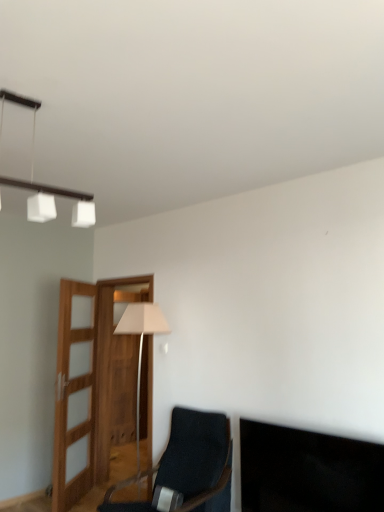
Describe the element at coordinates (46, 185) in the screenshot. I see `white matte cube at upper left` at that location.

This screenshot has width=384, height=512. What do you see at coordinates (141, 347) in the screenshot?
I see `white fabric lampshade at center` at bounding box center [141, 347].

Identify the location of black glossy tv at lower right. The image size is (384, 512). (308, 471).

From a real-world perspective, is black glossy tv at lower right physically below dark blue fabric chair at center?

No, from a real-world perspective, black glossy tv at lower right is not under dark blue fabric chair at center.

Is there a large distance between black glossy tv at lower right and dark blue fabric chair at center?

They are positioned close to each other.

From the image's perspective, which one is positioned higher, black glossy tv at lower right or dark blue fabric chair at center?

black glossy tv at lower right is shown above in the image.

Is point (146, 325) less distant than point (381, 463)?

No, (146, 325) is behind (381, 463).

The height and width of the screenshot is (512, 384). What are the coordinates of `table lamp behind the black glossy tv at lower right` in the screenshot? It's located at (141, 347).

Would you say white fabric lampshade at center is to the left or to the right of black glossy tv at lower right in the picture?

In the image, white fabric lampshade at center appears on the left side of black glossy tv at lower right.

Considering the relative sizes of dark blue fabric chair at center and white fabric lampshade at center in the image provided, is dark blue fabric chair at center shorter than white fabric lampshade at center?

Correct, dark blue fabric chair at center is not as tall as white fabric lampshade at center.

How many degrees apart are the facing directions of dark blue fabric chair at center and white fabric lampshade at center?

The facing directions of dark blue fabric chair at center and white fabric lampshade at center are 0.113 degrees apart.

From a real-world perspective, is dark blue fabric chair at center physically located above or below white fabric lampshade at center?

In terms of real-world spatial position, dark blue fabric chair at center is below white fabric lampshade at center.

Considering the points (133, 502) and (130, 333), which point is behind, point (133, 502) or point (130, 333)?

Positioned behind is point (133, 502).

Does white matte cube at upper left contain white fabric lampshade at center?

No, white fabric lampshade at center is located outside of white matte cube at upper left.

Is point (46, 197) farther from camera compared to point (125, 332)?

No, (46, 197) is closer to viewer.

Is white matte cube at upper left positioned far away from white fabric lampshade at center?

white matte cube at upper left is far away from white fabric lampshade at center.

Does white fabric lampshade at center lie in front of dark blue fabric chair at center?

No, white fabric lampshade at center is further to the viewer.

How many degrees apart are the facing directions of white fabric lampshade at center and dark blue fabric chair at center?

There is a 0.113-degree angle between the facing directions of white fabric lampshade at center and dark blue fabric chair at center.

Based on the photo, does white fabric lampshade at center have a greater height compared to dark blue fabric chair at center?

Yes, white fabric lampshade at center is taller than dark blue fabric chair at center.

Is white matte cube at upper left completely or partially outside of dark blue fabric chair at center?

white matte cube at upper left lies outside dark blue fabric chair at center's area.

Can you tell me how much white matte cube at upper left and dark blue fabric chair at center differ in facing direction?

They differ by 95.9 degrees in their facing directions.

From a real-world perspective, is white matte cube at upper left located beneath dark blue fabric chair at center?

Actually, white matte cube at upper left is physically above dark blue fabric chair at center in the real world.

Considering the sizes of objects white fabric lampshade at center and white matte cube at upper left in the image provided, who is shorter, white fabric lampshade at center or white matte cube at upper left?

white matte cube at upper left is shorter.

From a real-world perspective, is white fabric lampshade at center above or below white matte cube at upper left?

white fabric lampshade at center is below white matte cube at upper left.

Is white fabric lampshade at center placed right next to white matte cube at upper left?

No, white fabric lampshade at center is not touching white matte cube at upper left.

Is point (153, 327) positioned after point (35, 115)?

Yes, point (153, 327) is farther from viewer.

Locate an element on the screen. The image size is (384, 512). chair below the black glossy tv at lower right (from the image's perspective) is located at coordinates (197, 461).

The height and width of the screenshot is (512, 384). I want to click on table lamp that is on the left side of black glossy tv at lower right, so tap(141, 347).

From the picture: Estimate the real-world distances between objects in this image. Which object is closer to white matte cube at upper left, black glossy tv at lower right or white fabric lampshade at center?

The object closer to white matte cube at upper left is white fabric lampshade at center.

Looking at this image, from the image, which object appears to be nearer to dark blue fabric chair at center, white matte cube at upper left or black glossy tv at lower right?

black glossy tv at lower right.

When comparing their distances from black glossy tv at lower right, does white fabric lampshade at center or white matte cube at upper left seem further?

white matte cube at upper left lies further to black glossy tv at lower right than the other object.

Considering their positions, is black glossy tv at lower right positioned further to white fabric lampshade at center than dark blue fabric chair at center?

black glossy tv at lower right lies further to white fabric lampshade at center than the other object.

Consider the image. Which object lies nearer to the anchor point white fabric lampshade at center, black glossy tv at lower right or white matte cube at upper left?

Among the two, black glossy tv at lower right is located nearer to white fabric lampshade at center.

When comparing their distances from black glossy tv at lower right, does white matte cube at upper left or dark blue fabric chair at center seem further?

Based on the image, white matte cube at upper left appears to be further to black glossy tv at lower right.

From the image, which object appears to be farther from white matte cube at upper left, black glossy tv at lower right or dark blue fabric chair at center?

Among the two, dark blue fabric chair at center is located further to white matte cube at upper left.

In the scene shown: From the image, which object appears to be farther from white fabric lampshade at center, dark blue fabric chair at center or black glossy tv at lower right?

black glossy tv at lower right is further to white fabric lampshade at center.

Identify the location of dark between white matte cube at upper left and dark blue fabric chair at center in the up-down direction. (308, 471).

Where is `table lamp between white matte cube at upper left and dark blue fabric chair at center in the up-down direction`? The height and width of the screenshot is (512, 384). table lamp between white matte cube at upper left and dark blue fabric chair at center in the up-down direction is located at coordinates (141, 347).

Locate an element on the screen. table lamp between white matte cube at upper left and black glossy tv at lower right from top to bottom is located at coordinates (141, 347).

You are a GUI agent. You are given a task and a screenshot of the screen. Output one action in this format:
    pyautogui.click(x=<x>, y=<y>)
    Task: Click on the chair situated between white fabric lampshade at center and black glossy tv at lower right from left to right
    This screenshot has width=384, height=512.
    Given the screenshot: What is the action you would take?
    pyautogui.click(x=197, y=461)